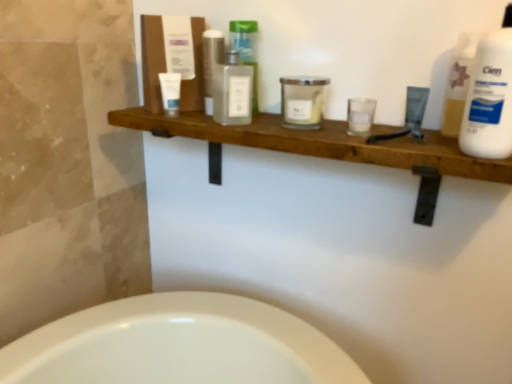
Question: Should I look upward or downward to see white plastic bottle at upper right?

Choices:
 (A) up
 (B) down

Answer: (A)

Question: Is white glass candle at center, the 4th toiletry from the left, thinner than white plastic bottle at upper right?

Choices:
 (A) yes
 (B) no

Answer: (B)

Question: Is white glass candle at center, the 4th toiletry from the left, completely or partially outside of white plastic bottle at upper right?

Choices:
 (A) no
 (B) yes

Answer: (B)

Question: Does white glass candle at center, which is the third toiletry from right to left, have a lesser height compared to white plastic bottle at upper right?

Choices:
 (A) no
 (B) yes

Answer: (B)

Question: From the image's perspective, is white glass candle at center, the 4th toiletry from the left, on top of white plastic bottle at upper right?

Choices:
 (A) yes
 (B) no

Answer: (A)

Question: From a real-world perspective, is white glass candle at center, the 4th toiletry from the left, physically above white plastic bottle at upper right?

Choices:
 (A) no
 (B) yes

Answer: (A)

Question: Is white glass candle at center, which is the third toiletry from right to left, smaller than white plastic bottle at upper right?

Choices:
 (A) no
 (B) yes

Answer: (B)

Question: Is translucent glass bottle at center, arranged as the fourth toiletry when viewed from the right, next to clear glass bottle at center, acting as the 2th toiletry starting from the left, and touching it?

Choices:
 (A) yes
 (B) no

Answer: (A)

Question: Are translucent glass bottle at center, arranged as the fourth toiletry when viewed from the right, and clear glass bottle at center, the 5th toiletry in the right-to-left sequence, far apart?

Choices:
 (A) yes
 (B) no

Answer: (B)

Question: Is clear glass bottle at center, the 5th toiletry in the right-to-left sequence, completely or partially inside translucent glass bottle at center, arranged as the fourth toiletry when viewed from the right?

Choices:
 (A) yes
 (B) no

Answer: (B)

Question: From a real-world perspective, is translucent glass bottle at center, arranged as the fourth toiletry when viewed from the right, below clear glass bottle at center, the 5th toiletry in the right-to-left sequence?

Choices:
 (A) no
 (B) yes

Answer: (A)

Question: Considering the relative positions of translucent glass bottle at center, the 3th toiletry in the left-to-right sequence, and clear glass bottle at center, acting as the 2th toiletry starting from the left, in the image provided, is translucent glass bottle at center, the 3th toiletry in the left-to-right sequence, in front of clear glass bottle at center, acting as the 2th toiletry starting from the left,?

Choices:
 (A) no
 (B) yes

Answer: (A)

Question: Does translucent glass bottle at center, the 3th toiletry in the left-to-right sequence, appear on the right side of clear glass bottle at center, the 5th toiletry in the right-to-left sequence?

Choices:
 (A) yes
 (B) no

Answer: (A)

Question: Does translucent glass bottle at center, arranged as the fourth toiletry when viewed from the right, have a larger size compared to white plastic bottle at upper right?

Choices:
 (A) no
 (B) yes

Answer: (A)